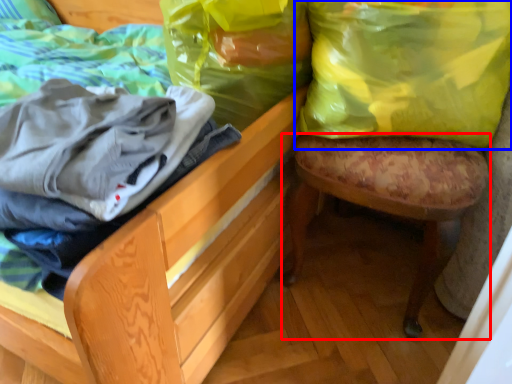
Question: Which object appears farthest to the camera in this image, stool (highlighted by a red box) or shopping bag (highlighted by a blue box)?

Choices:
 (A) stool
 (B) shopping bag

Answer: (B)